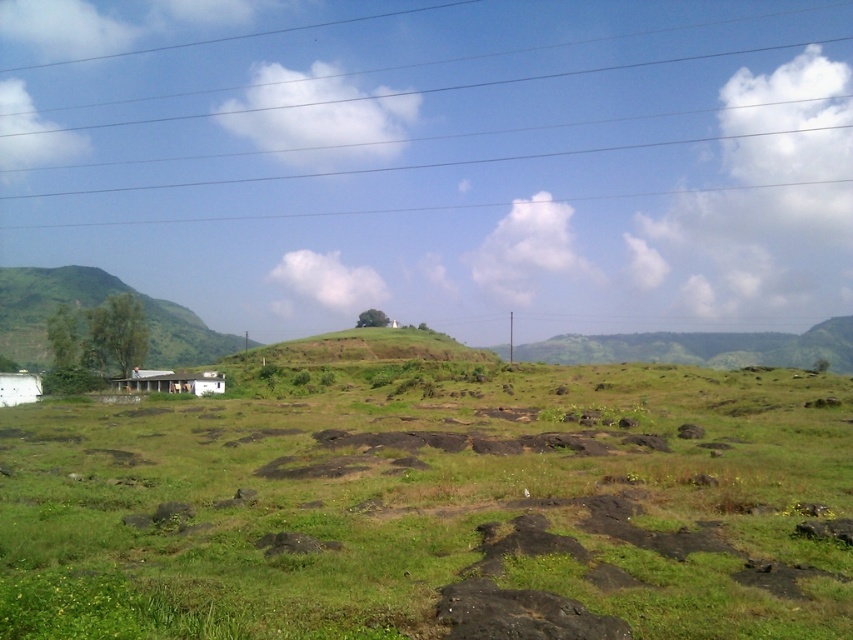
Question: Is green grassy at center positioned at the back of white wooden hut at lower left?

Choices:
 (A) no
 (B) yes

Answer: (A)

Question: Does metallic wires at upper center appear over white wooden hut at lower left?

Choices:
 (A) yes
 (B) no

Answer: (A)

Question: Is green grassy at center above white wooden hut at lower left?

Choices:
 (A) yes
 (B) no

Answer: (A)

Question: Among these points, which one is nearest to the camera?

Choices:
 (A) (374, 467)
 (B) (573, 26)

Answer: (A)

Question: Considering the real-world distances, which object is closest to the green grassy hillside at left?

Choices:
 (A) white wooden hut at lower left
 (B) green grassy at center
 (C) metallic wires at upper center

Answer: (A)

Question: Which is farther from the green grassy hillside at left?

Choices:
 (A) metallic wires at upper center
 (B) white wooden hut at lower left
 (C) green grassy at center

Answer: (A)